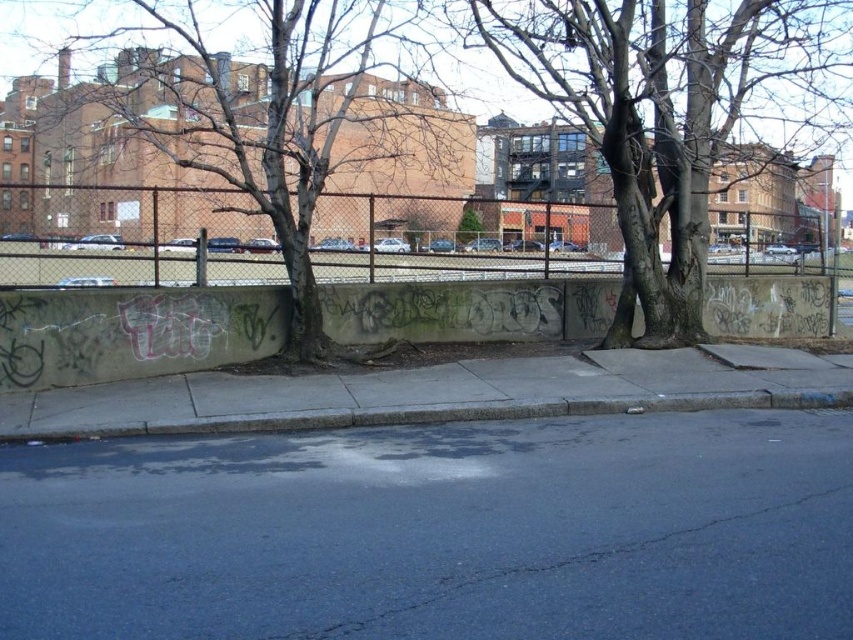
Is gray bark tree at left smaller than metallic chain-link fence at center?

Yes.

Is point (134, 115) positioned before point (416, 268)?

Yes.

This screenshot has height=640, width=853. In order to click on gray bark tree at left in this screenshot , I will do `click(274, 122)`.

Does bare wood tree at center appear on the right side of metallic chain-link fence at center?

Correct, you'll find bare wood tree at center to the right of metallic chain-link fence at center.

Find the location of a particular element. bare wood tree at center is located at coordinates (660, 115).

Where is `bare wood tree at center`? Image resolution: width=853 pixels, height=640 pixels. bare wood tree at center is located at coordinates (660, 115).

Between dark asphalt pavement at lower center and gray bark tree at left, which one has more height?

Standing taller between the two is gray bark tree at left.

Consider the image. Is dark asphalt pavement at lower center shorter than gray bark tree at left?

Yes.

You are a GUI agent. You are given a task and a screenshot of the screen. Output one action in this format:
    pyautogui.click(x=<x>, y=<y>)
    Task: Click on the dark asphalt pavement at lower center
    
    Given the screenshot: What is the action you would take?
    pyautogui.click(x=438, y=531)

Locate an element on the screen. This screenshot has height=640, width=853. dark asphalt pavement at lower center is located at coordinates (438, 531).